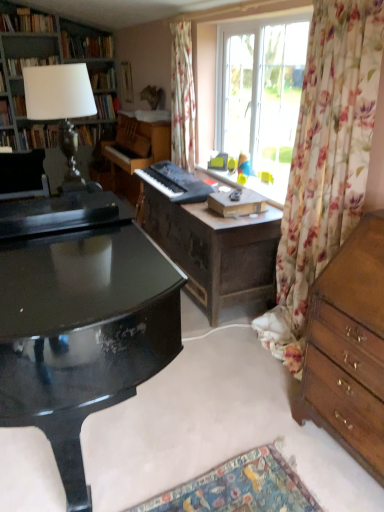
Identify the location of vacant space to the right of glossy wood desk at center. (235, 404).